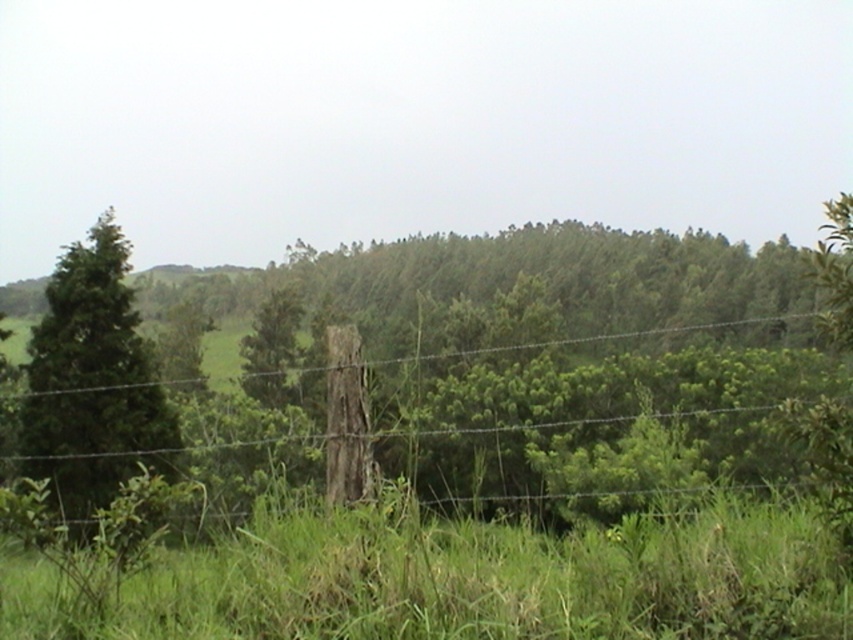
You are a drone operator trying to navigate a drone through the rural landscape shown. The drone needs to pass between the wire mesh at center and the dense forest of trees behind it. Based on the coordinates provided, is there enough space for the drone to safely fly through this area?

The wire mesh at center is located at point [611,408], which indicates its position relative to the forest. Since the coordinates show the wire mesh is positioned in front of the dense forest, there should be sufficient space between them for the drone to safely navigate through.

You are a hiker who wants to cross the barbed wire fence at the bottom of the image. There is a point marked at coordinates point (611, 408). What is the object located at that point?

The point (611, 408) marks the wire mesh at center.

You are standing in front of the barbed wire fence and see the green matte tree at left and the green matte tree at center. Which tree is positioned to the right of the other?

The green matte tree at left is positioned to the right of the green matte tree at center.